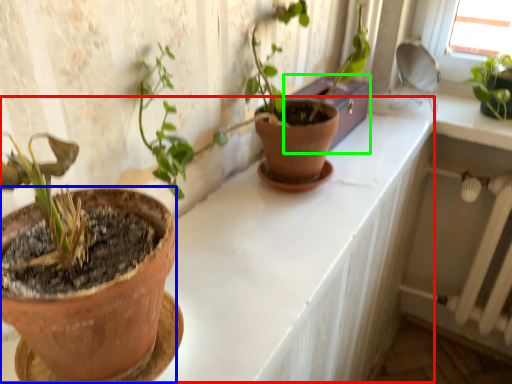
Question: Estimate the real-world distances between objects in this image. Which object is farther from counter (highlighted by a red box), flowerpot (highlighted by a blue box) or window box (highlighted by a green box)?

Choices:
 (A) flowerpot
 (B) window box

Answer: (A)